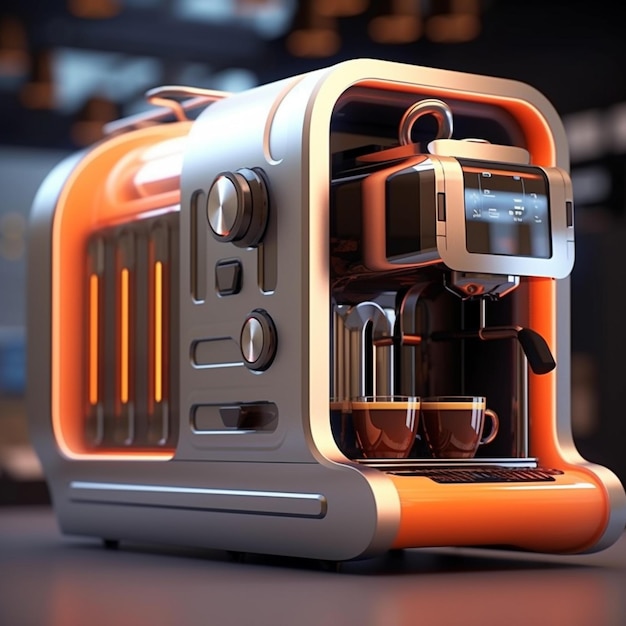
At what (x,y) coordinates should I click in order to perform the action: click on foam layer. Please return your answer as a coordinate pair (x, y). This screenshot has width=626, height=626. Looking at the image, I should click on (385, 406), (469, 406).